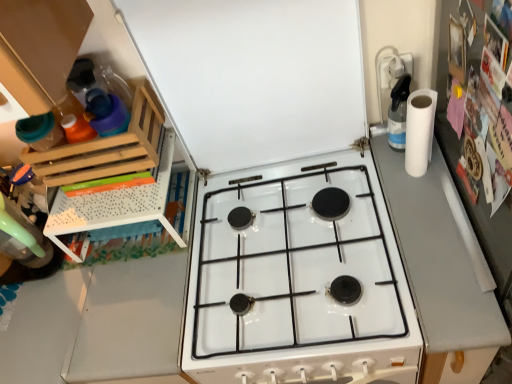
Where is `free location in front of white matte exhaust hood at upper center`? free location in front of white matte exhaust hood at upper center is located at coordinates (301, 227).